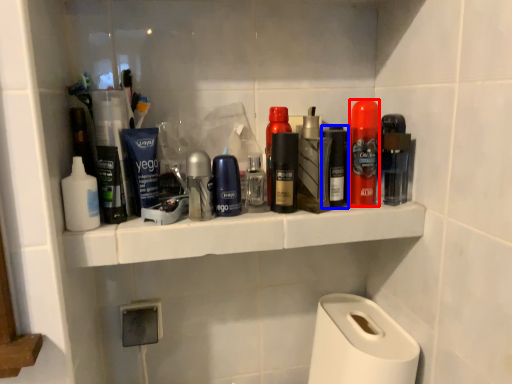
Question: Which object is closer to the camera taking this photo, personal care (highlighted by a red box) or personal care (highlighted by a blue box)?

Choices:
 (A) personal care
 (B) personal care

Answer: (A)